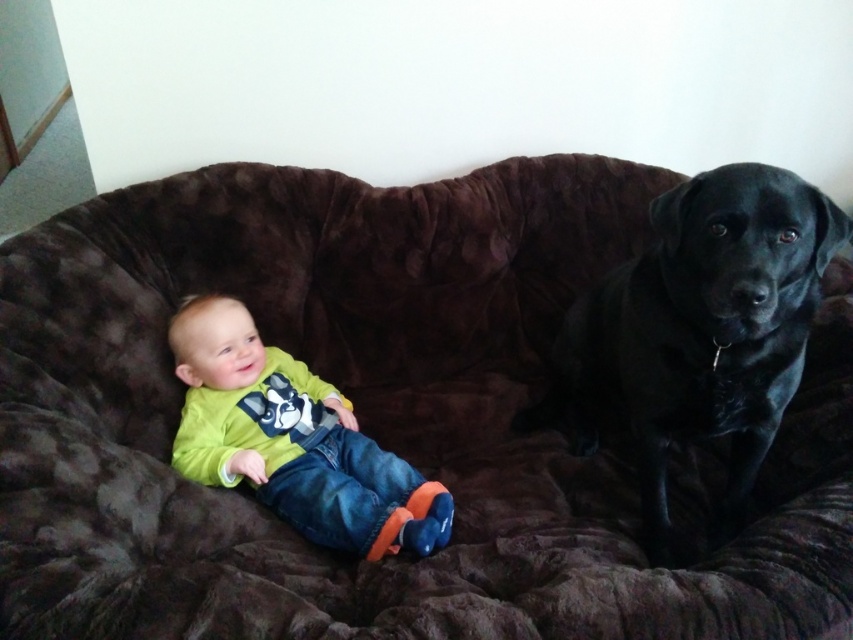
Question: Is black velvet dog at right smaller than lime green jersey at center?

Choices:
 (A) no
 (B) yes

Answer: (A)

Question: Does black velvet dog at right have a lesser width compared to lime green jersey at center?

Choices:
 (A) yes
 (B) no

Answer: (A)

Question: Considering the relative positions of black velvet dog at right and lime green jersey at center in the image provided, where is black velvet dog at right located with respect to lime green jersey at center?

Choices:
 (A) below
 (B) above

Answer: (B)

Question: Which of the following is the closest to the observer?

Choices:
 (A) black velvet dog at right
 (B) lime green jersey at center

Answer: (A)